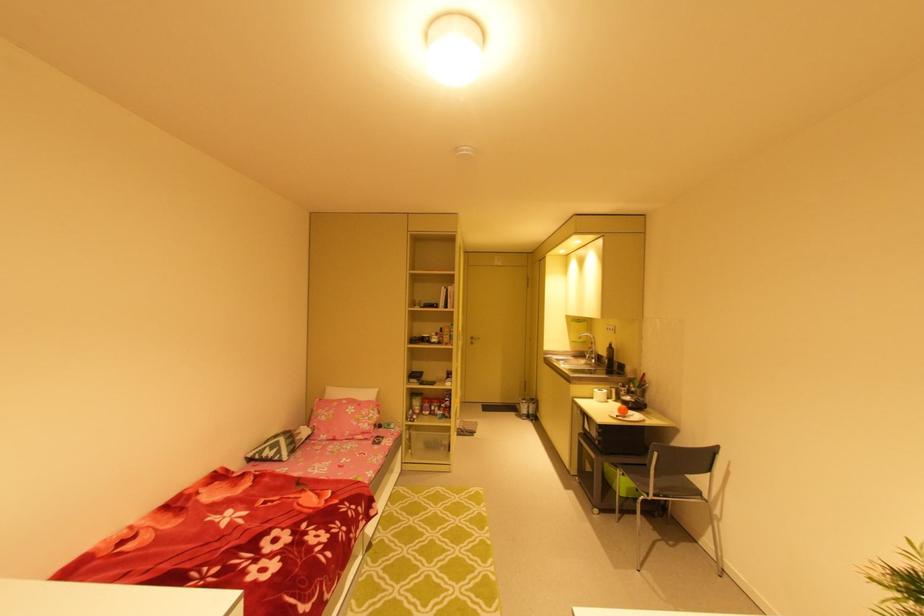
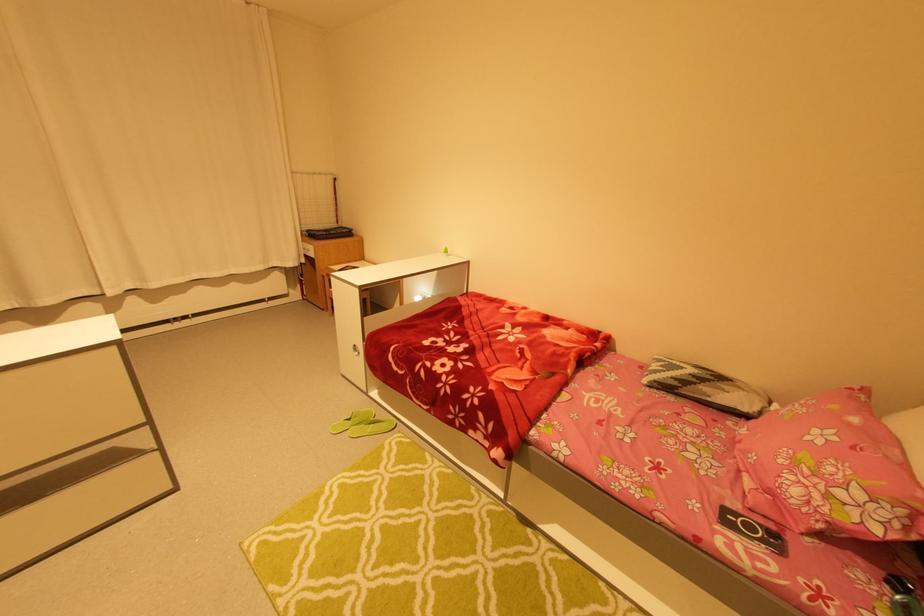
The point at [383,438] is marked in the first image. Where is the corresponding point in the second image?

(781, 536)